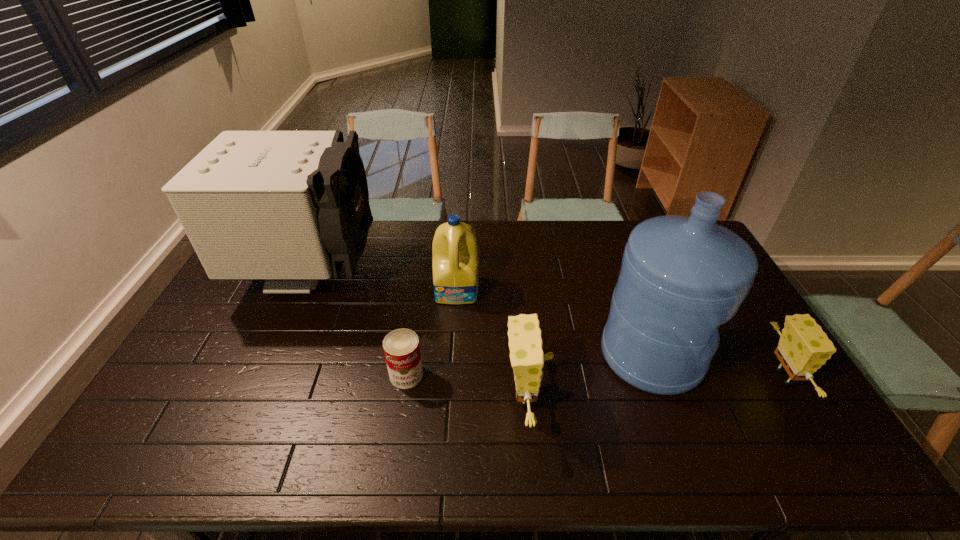
Where is `object situated at the near right corner`? The image size is (960, 540). object situated at the near right corner is located at coordinates tap(804, 347).

Locate an element on the screen. The height and width of the screenshot is (540, 960). free region at the far edge is located at coordinates (508, 239).

I want to click on vacant space at the near edge of the desktop, so (260, 396).

The height and width of the screenshot is (540, 960). In the image, there is a desktop. In order to click on free space at the left edge in this screenshot , I will do `click(257, 302)`.

Where is `vacant point located between the shorter sponge and the water jug`? Image resolution: width=960 pixels, height=540 pixels. vacant point located between the shorter sponge and the water jug is located at coordinates (717, 366).

Locate an element on the screen. free space between the fifth object from right to left and the leftmost object is located at coordinates (358, 325).

Where is `vacant area that lies between the third tallest object and the fan`? This screenshot has width=960, height=540. vacant area that lies between the third tallest object and the fan is located at coordinates (384, 282).

I want to click on vacant area that lies between the fifth object from left to right and the second shortest object, so click(717, 366).

Where is `free space between the detergent and the second object from left to right`? This screenshot has width=960, height=540. free space between the detergent and the second object from left to right is located at coordinates (432, 333).

You are a GUI agent. You are given a task and a screenshot of the screen. Output one action in this format:
    pyautogui.click(x=<x>, y=<y>)
    Task: Click on the free space that is in between the water jug and the detergent
    Image resolution: width=960 pixels, height=540 pixels.
    Given the screenshot: What is the action you would take?
    [555, 322]